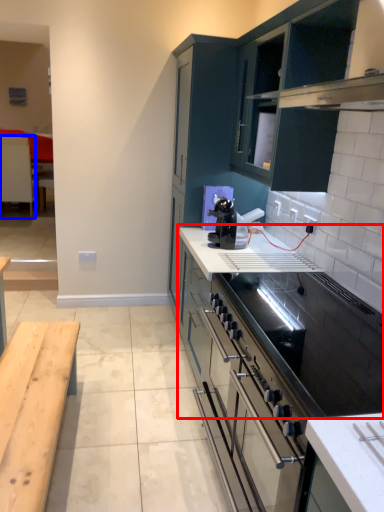
Question: Which object is further to the camera taking this photo, countertop (highlighted by a red box) or table (highlighted by a blue box)?

Choices:
 (A) countertop
 (B) table

Answer: (B)